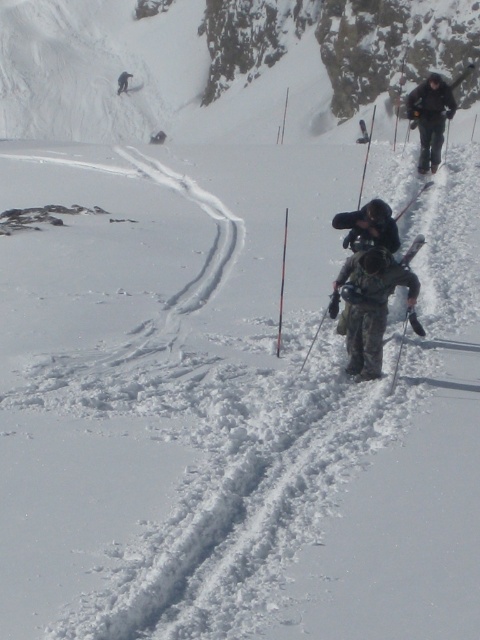
Question: Which object appears farthest from the camera in this image?

Choices:
 (A) black matte backpack at center
 (B) dark gray snowsuit at upper center
 (C) black fabric jacket at upper right
 (D) camouflage fabric jacket at center

Answer: (B)

Question: Among these points, which one is farthest from the camera?

Choices:
 (A) (420, 99)
 (B) (363, 209)
 (C) (121, 83)

Answer: (C)

Question: Can you confirm if black matte backpack at center is positioned above dark gray snowsuit at upper center?

Choices:
 (A) yes
 (B) no

Answer: (B)

Question: Considering the relative positions of camouflage fabric jacket at center and dark gray snowsuit at upper center in the image provided, where is camouflage fabric jacket at center located with respect to dark gray snowsuit at upper center?

Choices:
 (A) above
 (B) below

Answer: (B)

Question: Can you confirm if black fabric jacket at upper right is positioned above dark gray snowsuit at upper center?

Choices:
 (A) yes
 (B) no

Answer: (B)

Question: Which is nearer to the dark gray snowsuit at upper center?

Choices:
 (A) camouflage fabric jacket at center
 (B) black fabric jacket at upper right

Answer: (B)